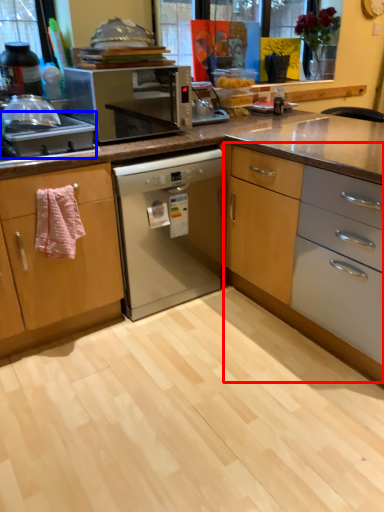
Question: Which object is closer to the camera taking this photo, cabinetry (highlighted by a red box) or kitchen appliance (highlighted by a blue box)?

Choices:
 (A) cabinetry
 (B) kitchen appliance

Answer: (A)